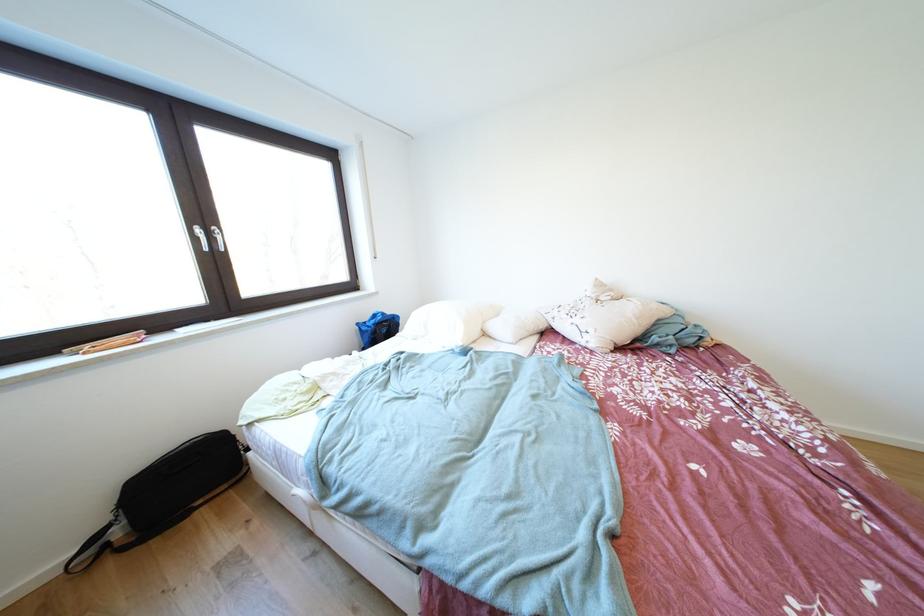
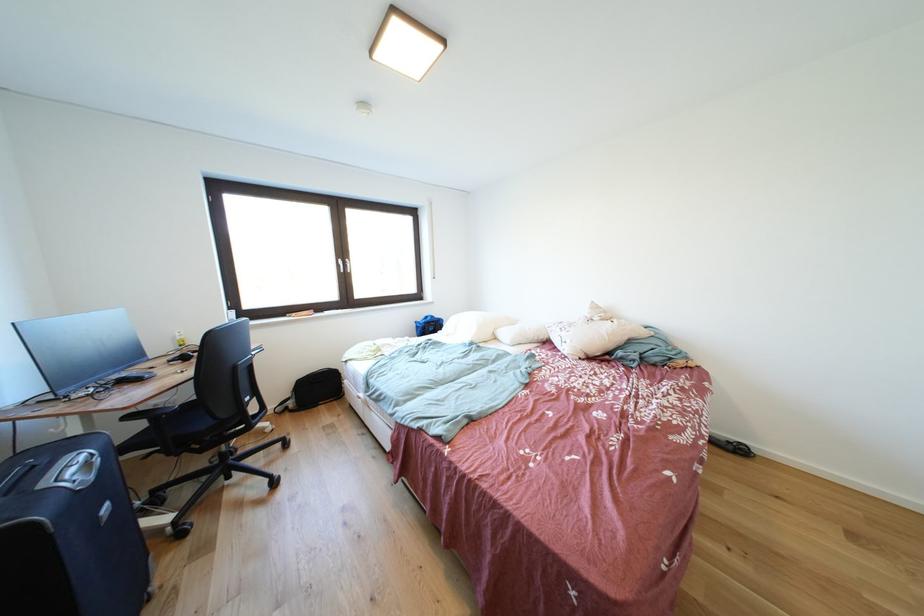
The point at [126,537] is marked in the first image. Where is the corresponding point in the second image?

(299, 408)